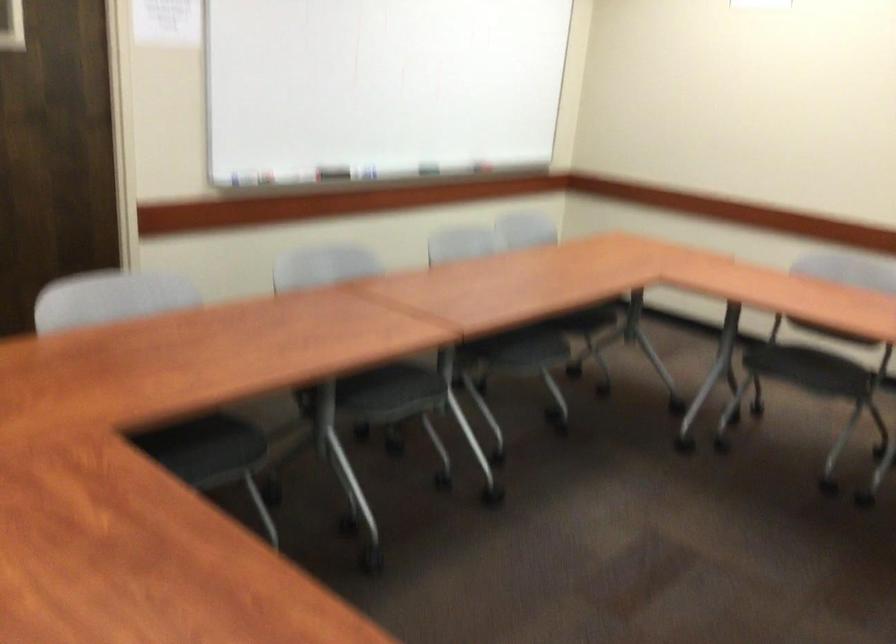
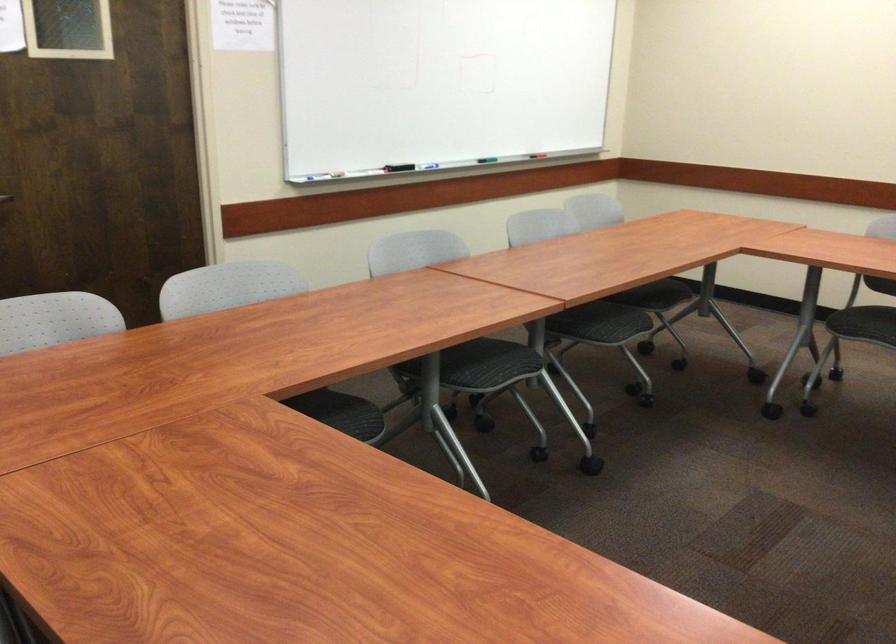
Find the pixel in the second image that matches point 382,91 in the first image.

(438, 82)